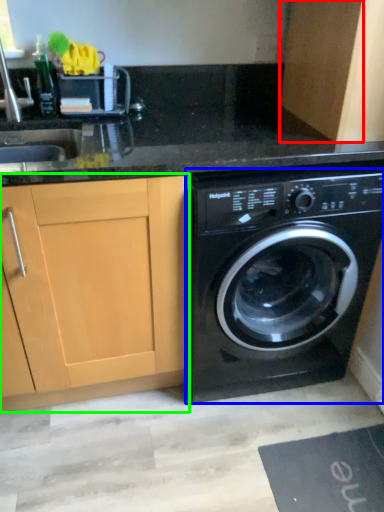
Question: Based on their relative distances, which object is nearer to cabinetry (highlighted by a red box)? Choose from washing machine (highlighted by a blue box) and cabinetry (highlighted by a green box).

Choices:
 (A) washing machine
 (B) cabinetry

Answer: (A)